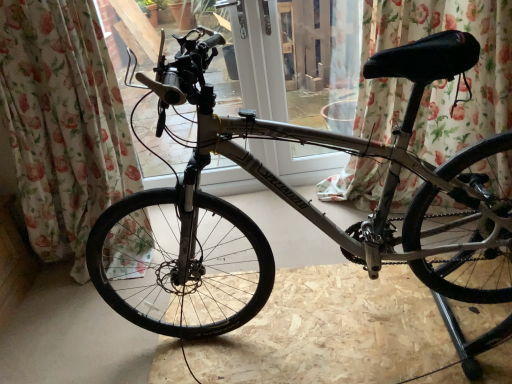
Question: Is floral fabric curtain at left, positioned as the second curtain in right-to-left order, wider or thinner than floral fabric curtain at upper center, the 2th curtain in the left-to-right sequence?

Choices:
 (A) wide
 (B) thin

Answer: (A)

Question: Is floral fabric curtain at left, the first curtain viewed from the left, inside or outside of floral fabric curtain at upper center, which appears as the 1th curtain when viewed from the right?

Choices:
 (A) outside
 (B) inside

Answer: (A)

Question: Based on their relative distances, which object is farther from the floral fabric curtain at left, positioned as the second curtain in right-to-left order?

Choices:
 (A) floral fabric curtain at upper center, the 2th curtain in the left-to-right sequence
 (B) silver metallic bicycle at center

Answer: (A)

Question: Considering the real-world distances, which object is closest to the silver metallic bicycle at center?

Choices:
 (A) floral fabric curtain at left, the first curtain viewed from the left
 (B) floral fabric curtain at upper center, which appears as the 1th curtain when viewed from the right

Answer: (A)